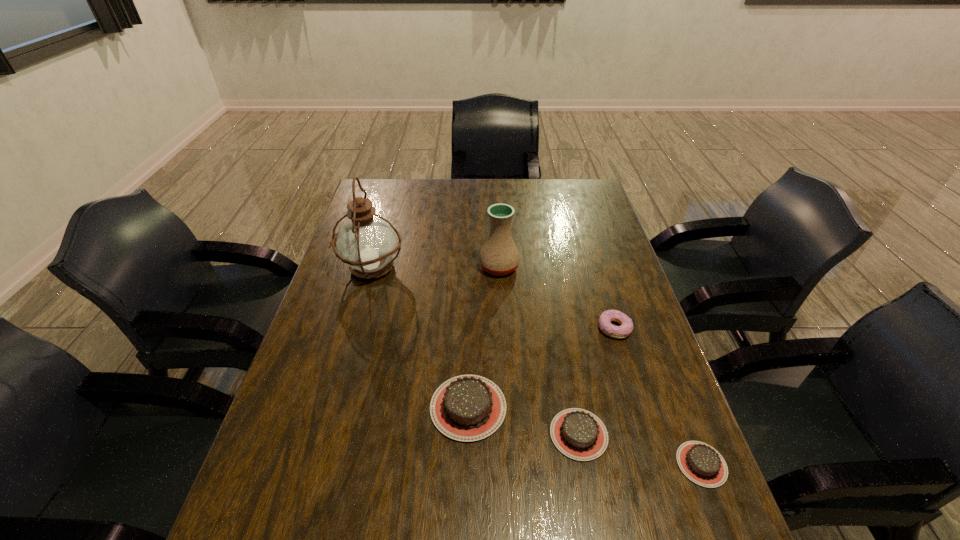
I want to click on free spot between the fifth shortest object and the tallest chocolate cake, so click(484, 337).

The image size is (960, 540). I want to click on vacant area that lies between the doughnut and the shortest object, so click(x=658, y=396).

Find the location of a particular element. Image resolution: width=960 pixels, height=540 pixels. free space between the oil lamp and the second shortest chocolate cake is located at coordinates pyautogui.click(x=475, y=352).

Find the location of `free spot between the fourth object from left to right and the third farthest object`. free spot between the fourth object from left to right and the third farthest object is located at coordinates (597, 381).

The image size is (960, 540). I want to click on vacant space in between the pottery and the oil lamp, so click(x=435, y=268).

Image resolution: width=960 pixels, height=540 pixels. In order to click on free space between the third farthest object and the shortest object in this screenshot , I will do `click(658, 396)`.

This screenshot has height=540, width=960. What are the coordinates of `vacant space that is in between the rightmost chocolate cake and the pottery` in the screenshot? It's located at (600, 366).

Where is `object that is the nearest to the pottery`? object that is the nearest to the pottery is located at coordinates (367, 243).

Select which object appears as the fifth closest to the shortest object. Please provide its 2D coordinates. Your answer should be formatted as a tuple, i.e. [(x, y)], where the tuple contains the x and y coordinates of a point satisfying the conditions above.

[(367, 243)]

Identify which chocolate cake is the second closest to the third farthest object. Please provide its 2D coordinates. Your answer should be formatted as a tuple, i.e. [(x, y)], where the tuple contains the x and y coordinates of a point satisfying the conditions above.

[(466, 408)]